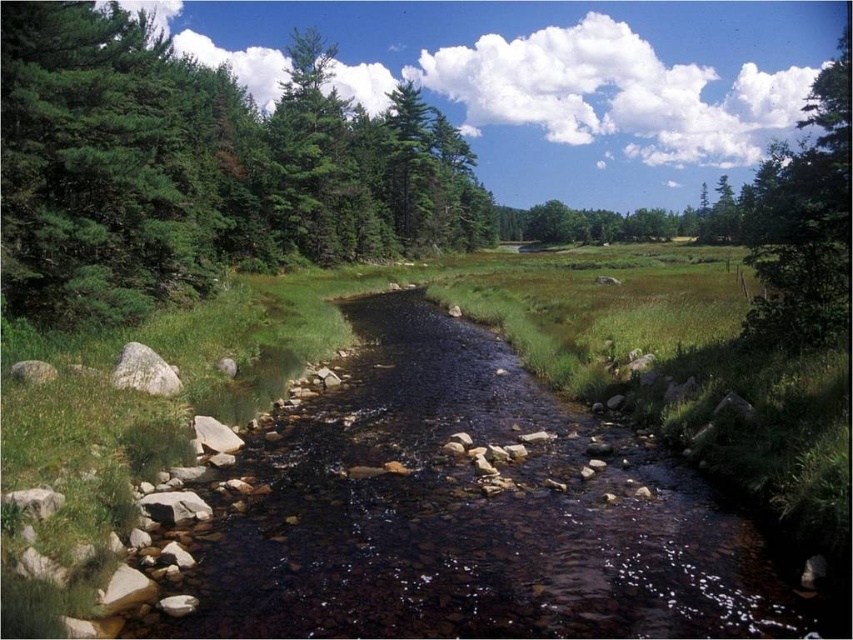
You are a hiker standing at the green matte tree at left and want to reach the smooth rock stream at center. Can you walk directly to it without any obstacles? The path is straight. Your legs can cover 200 meters in one go. Do you think you can make it?

The distance between the green matte tree at left and the smooth rock stream at center is 190.05 meters, which is within your 200 meters range. So yes, you can walk directly to it without any obstacles.

You are standing at the center of the valley and want to place a small statue exactly at the coordinates mentioned in the description of the smooth rock stream at center. What are the coordinates where you should place the statue?

You should place the statue at the coordinates (473, 515) as mentioned in the description of the smooth rock stream at center.